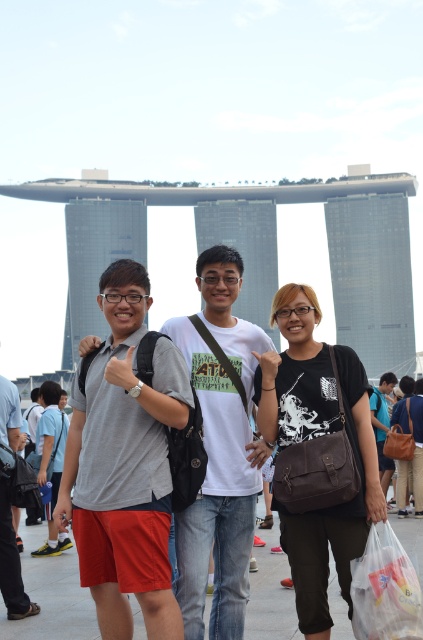
Question: Considering the relative positions of matte black bag at center and translucent plastic bag at lower right in the image provided, where is matte black bag at center located with respect to translucent plastic bag at lower right?

Choices:
 (A) below
 (B) above

Answer: (B)

Question: Observing the image, what is the correct spatial positioning of matte black bag at center in reference to matte brown bag at center?

Choices:
 (A) above
 (B) below

Answer: (A)

Question: Considering the real-world distances, which object is closest to the matte black bag at center?

Choices:
 (A) matte brown bag at center
 (B) brown leather bag at center

Answer: (A)

Question: Is matte black bag at center above matte brown bag at center?

Choices:
 (A) no
 (B) yes

Answer: (B)

Question: Which point is closer to the camera?

Choices:
 (A) (151, 630)
 (B) (238, 332)
 (C) (382, 378)
 (D) (373, 636)

Answer: (A)

Question: Which point is farther from the camera taking this photo?

Choices:
 (A) (370, 602)
 (B) (63, 481)
 (C) (261, 456)
 (D) (47, 508)

Answer: (D)